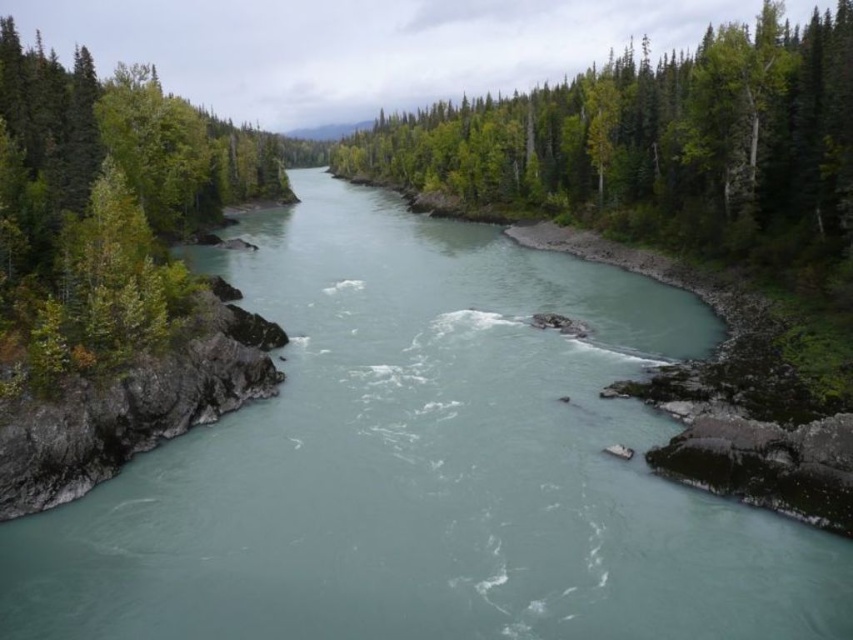
You are standing at the edge of the river and want to locate the green leafy trees at center. According to the coordinates provided, in which direction should you look relative to your position?

You should look towards the coordinates point at (659,145) to find the green leafy trees at center.